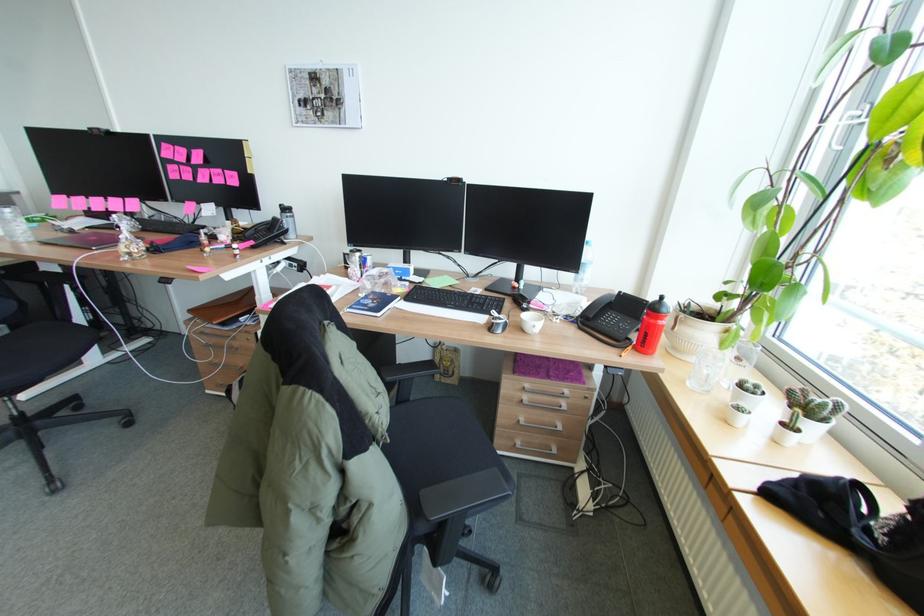
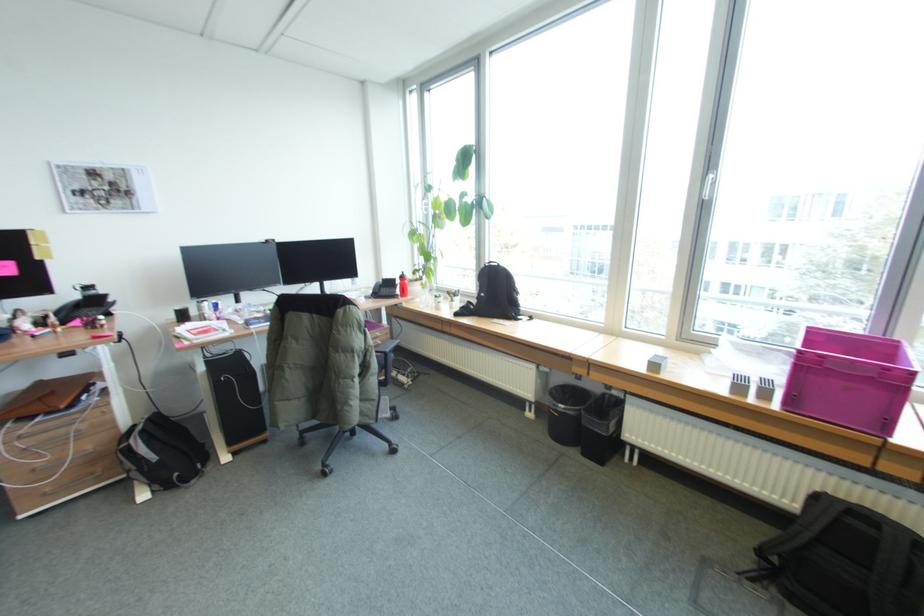
In the second image, find the point that corresponds to point (238, 384) in the first image.

(135, 444)